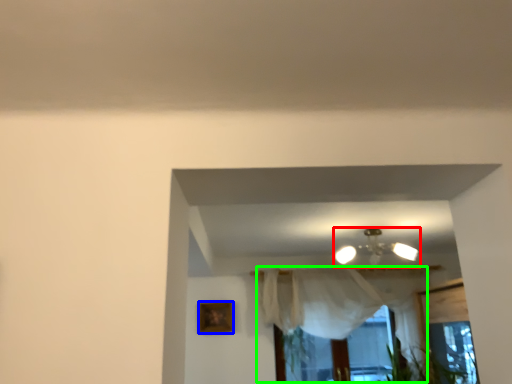
Question: Which object is positioned farthest from lamp (highlighted by a red box)? Select from picture frame (highlighted by a blue box) and curtain (highlighted by a green box).

Choices:
 (A) picture frame
 (B) curtain

Answer: (A)